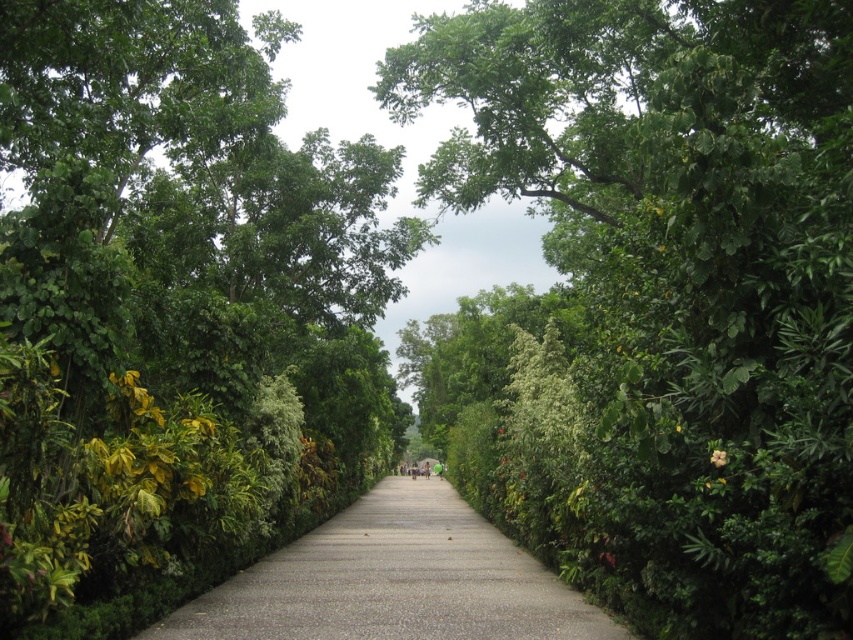
You are standing on the gray concrete pavement at center and want to walk towards the green leafy tree at center. Is the tree ahead of you or behind you?

The green leafy tree at center is closer to the viewer than the gray concrete pavement at center, so the tree is ahead of you. You can walk towards it directly.

You are a gardener planning to plant a new tree in the garden. You have a green leafy tree at center and a gray concrete pavement at center in the image. Which object is wider?

The green leafy tree at center might be wider than gray concrete pavement at center.

You are a gardener with a 30 feet long hose. You need to water both the green leafy tree at center and the gray concrete pavement at center. Can you reach both spots with your hose without moving it?

The green leafy tree at center and the gray concrete pavement at center are 28.76 feet apart from each other. Since the hose is 30 feet long, it can easily reach both spots without needing to move it.